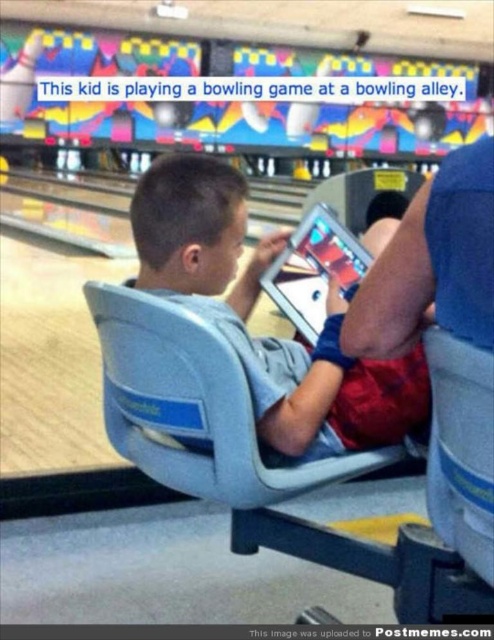
Question: Among these points, which one is farthest from the camera?

Choices:
 (A) (326, 483)
 (B) (275, 273)

Answer: (B)

Question: Estimate the real-world distances between objects in this image. Which object is farther from the gray plastic chair at center?

Choices:
 (A) silver glossy tablet at center
 (B) light blue fabric chair at center

Answer: (A)

Question: Among these objects, which one is nearest to the camera?

Choices:
 (A) silver glossy tablet at center
 (B) gray plastic chair at center

Answer: (B)

Question: Does light blue fabric chair at center appear on the left side of gray plastic chair at center?

Choices:
 (A) no
 (B) yes

Answer: (A)

Question: Does light blue fabric chair at center have a lesser width compared to gray plastic chair at center?

Choices:
 (A) no
 (B) yes

Answer: (B)

Question: Does light blue fabric chair at center have a larger size compared to silver glossy tablet at center?

Choices:
 (A) yes
 (B) no

Answer: (A)